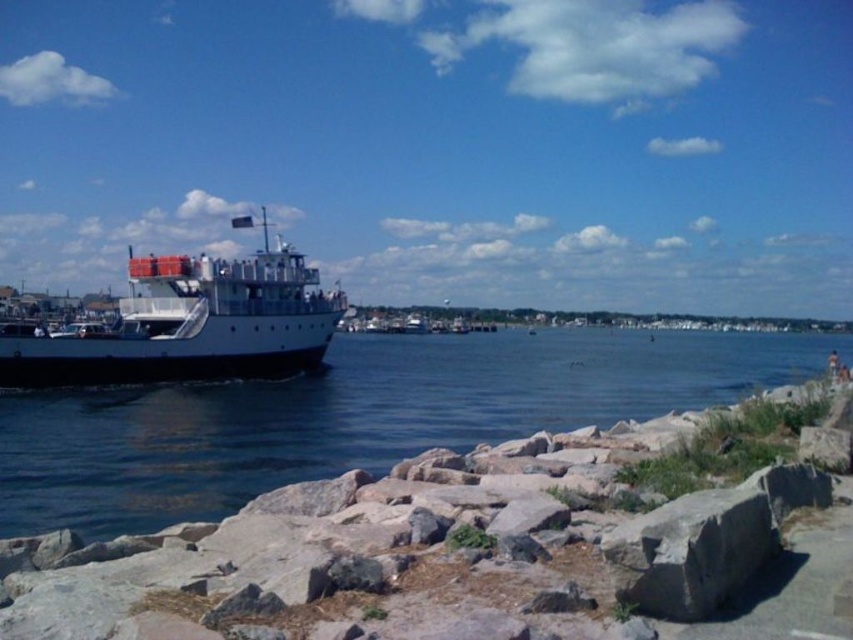
You are standing on the rocky shoreline and notice the blue water at left and the white matte boat at left. Which one appears taller from your viewpoint?

The white matte boat at left appears taller than the blue water at left because the blue water at left is not as tall as the white matte boat at left.

You are standing on the rocky shoreline and see the blue water at left and the white matte boat at left. Which object is closer to your right side?

The blue water at left is positioned on the right side of white matte boat at left, so the blue water at left is closer to your right side.

You are standing at point (160,307) and want to walk to the white ferry boat on the left. Is point (16,420) closer to the ferry boat than you are?

Point (16,420) is in front of point (160,307), so yes, point (16,420) is closer to the ferry boat than you are.